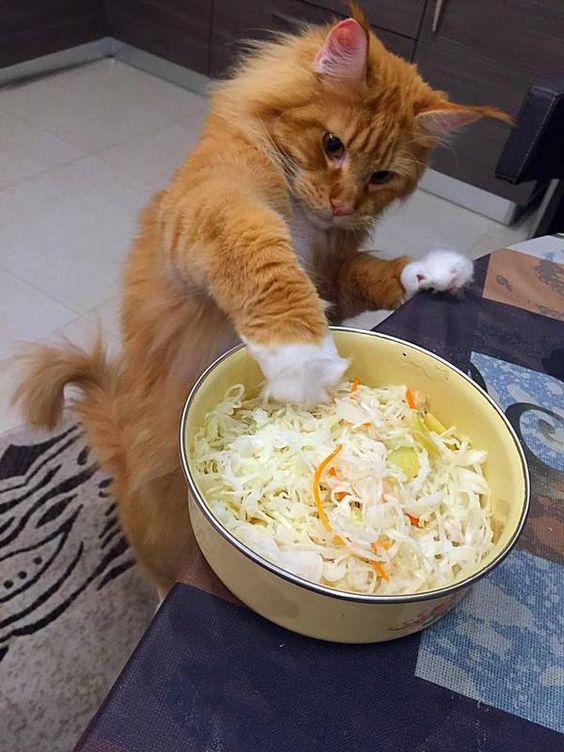
Where is `cabinet`? The height and width of the screenshot is (752, 564). cabinet is located at coordinates (445, 47).